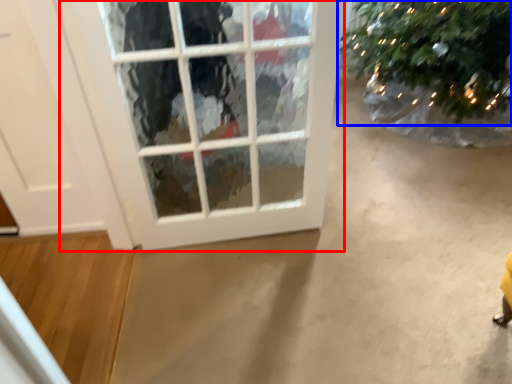
Question: Among these objects, which one is nearest to the camera, window (highlighted by a red box) or christmas tree (highlighted by a blue box)?

Choices:
 (A) window
 (B) christmas tree

Answer: (A)